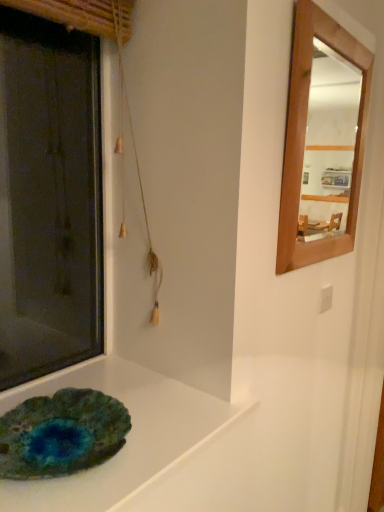
In order to click on vacant space to the right of teal agate plate at lower left in this screenshot , I will do `click(170, 441)`.